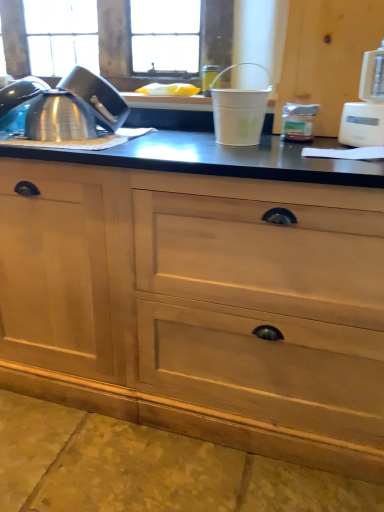
You are a GUI agent. You are given a task and a screenshot of the screen. Output one action in this format:
    pyautogui.click(x=<x>, y=<y>)
    Task: Click on the wooden cabinet at right, the 2th cabinetry in the left-to-right sequence
    The height and width of the screenshot is (512, 384).
    Given the screenshot: What is the action you would take?
    327,56

What do you see at coordinates (64, 106) in the screenshot? I see `satin metallic teapot at left` at bounding box center [64, 106].

Find the location of a particular element. satin metallic teapot at left is located at coordinates (64, 106).

In order to face white plastic blender at right, placed as the 2th appliance when sorted from left to right, should I rotate leftwards or rightwards?

You should rotate right by 25.164 degrees.

Identify the location of white plastic blender at right, placed as the 2th appliance when sorted from left to right. (366, 106).

Where is `wooden cabinet at right, positioned as the first cabinetry in right-to-left order`? This screenshot has height=512, width=384. wooden cabinet at right, positioned as the first cabinetry in right-to-left order is located at coordinates (327, 56).

How many degrees apart are the facing directions of wooden cabinet at right, the 2th cabinetry in the left-to-right sequence, and natural wood cabinet at center, placed as the first cabinetry when sorted from left to right?

The angular difference between wooden cabinet at right, the 2th cabinetry in the left-to-right sequence, and natural wood cabinet at center, placed as the first cabinetry when sorted from left to right, is 0.434 degrees.

Is wooden cabinet at right, positioned as the first cabinetry in right-to-left order, thinner than natural wood cabinet at center, the second cabinetry positioned from the right?

Yes, wooden cabinet at right, positioned as the first cabinetry in right-to-left order, is thinner than natural wood cabinet at center, the second cabinetry positioned from the right.

Between wooden cabinet at right, the 2th cabinetry in the left-to-right sequence, and natural wood cabinet at center, placed as the first cabinetry when sorted from left to right, which one has less height?

wooden cabinet at right, the 2th cabinetry in the left-to-right sequence, is shorter.

Which is further, (288, 92) or (231, 401)?

Positioned behind is point (288, 92).

Which object is more forward, white plastic blender at right, the 1th appliance from the right, or natural wood cabinet at center, placed as the first cabinetry when sorted from left to right?

natural wood cabinet at center, placed as the first cabinetry when sorted from left to right.

Which of these two, white plastic blender at right, the 1th appliance from the right, or natural wood cabinet at center, placed as the first cabinetry when sorted from left to right, is bigger?

Bigger between the two is natural wood cabinet at center, placed as the first cabinetry when sorted from left to right.

Does point (364, 57) come in front of point (335, 439)?

No.

Does natural wood cabinet at center, the second cabinetry positioned from the right, have a smaller size compared to satin metallic teapot at left?

No.

Looking at this image, are natural wood cabinet at center, the second cabinetry positioned from the right, and satin metallic teapot at left far apart?

No, there isn't a large distance between natural wood cabinet at center, the second cabinetry positioned from the right, and satin metallic teapot at left.

Consider the image. Relative to satin metallic teapot at left, is natural wood cabinet at center, placed as the first cabinetry when sorted from left to right, in front or behind?

In the image, natural wood cabinet at center, placed as the first cabinetry when sorted from left to right, appears in front of satin metallic teapot at left.

Is point (357, 352) positioned in front of point (96, 122)?

Yes, it is in front of point (96, 122).

Between white plastic bucket at center, the 1th appliance when ordered from left to right, and white plastic blender at right, the 1th appliance from the right, which one has larger size?

Bigger between the two is white plastic blender at right, the 1th appliance from the right.

From the picture: Considering the sizes of white plastic bucket at center, which is the 2th appliance from right to left, and white plastic blender at right, the 1th appliance from the right, in the image, is white plastic bucket at center, which is the 2th appliance from right to left, taller or shorter than white plastic blender at right, the 1th appliance from the right,?

In the image, white plastic bucket at center, which is the 2th appliance from right to left, appears to be shorter than white plastic blender at right, the 1th appliance from the right.

Is white plastic bucket at center, the 1th appliance when ordered from left to right, positioned beyond the bounds of white plastic blender at right, placed as the 2th appliance when sorted from left to right?

white plastic bucket at center, the 1th appliance when ordered from left to right, is positioned outside white plastic blender at right, placed as the 2th appliance when sorted from left to right.

Which of these two, natural wood cabinet at center, the second cabinetry positioned from the right, or wooden cabinet at right, the 2th cabinetry in the left-to-right sequence, stands shorter?

wooden cabinet at right, the 2th cabinetry in the left-to-right sequence, is shorter.

Is natural wood cabinet at center, placed as the first cabinetry when sorted from left to right, touching wooden cabinet at right, the 2th cabinetry in the left-to-right sequence?

No.

Is point (218, 436) closer to camera compared to point (297, 10)?

Yes.

From a real-world perspective, is natural wood cabinet at center, the second cabinetry positioned from the right, on top of wooden cabinet at right, the 2th cabinetry in the left-to-right sequence?

Actually, natural wood cabinet at center, the second cabinetry positioned from the right, is physically below wooden cabinet at right, the 2th cabinetry in the left-to-right sequence, in the real world.

Between satin metallic teapot at left and natural wood cabinet at center, the second cabinetry positioned from the right, which one is positioned behind?

satin metallic teapot at left is behind.

Does point (81, 77) lie behind point (280, 301)?

Yes, point (81, 77) is farther from viewer.

Can you confirm if satin metallic teapot at left is positioned to the right of natural wood cabinet at center, placed as the first cabinetry when sorted from left to right?

No.

From the image's perspective, which object appears higher, natural wood cabinet at center, the second cabinetry positioned from the right, or white plastic bucket at center, the 1th appliance when ordered from left to right?

white plastic bucket at center, the 1th appliance when ordered from left to right.

Is point (281, 435) positioned behind point (238, 104)?

Yes, it is behind point (238, 104).

Does natural wood cabinet at center, the second cabinetry positioned from the right, come behind white plastic bucket at center, which is the 2th appliance from right to left?

No, the depth of natural wood cabinet at center, the second cabinetry positioned from the right, is less than that of white plastic bucket at center, which is the 2th appliance from right to left.

Find the location of `cabinetry below the wooden cabinet at right, the 2th cabinetry in the left-to-right sequence (from a real-world perspective)`. cabinetry below the wooden cabinet at right, the 2th cabinetry in the left-to-right sequence (from a real-world perspective) is located at coordinates click(199, 306).

Find the location of a particular element. appliance that is the 2nd object located above the natural wood cabinet at center, placed as the first cabinetry when sorted from left to right (from the image's perspective) is located at coordinates (366, 106).

Estimate the real-world distances between objects in this image. Which object is closer to satin metallic teapot at left, white plastic bucket at center, the 1th appliance when ordered from left to right, or white plastic blender at right, the 1th appliance from the right?

white plastic bucket at center, the 1th appliance when ordered from left to right, lies closer to satin metallic teapot at left than the other object.

Looking at the image, which one is located closer to wooden cabinet at right, positioned as the first cabinetry in right-to-left order, white plastic bucket at center, which is the 2th appliance from right to left, or natural wood cabinet at center, the second cabinetry positioned from the right?

Among the two, white plastic bucket at center, which is the 2th appliance from right to left, is located nearer to wooden cabinet at right, positioned as the first cabinetry in right-to-left order.

When comparing their distances from white plastic blender at right, placed as the 2th appliance when sorted from left to right, does satin metallic teapot at left or wooden cabinet at right, the 2th cabinetry in the left-to-right sequence, seem further?

satin metallic teapot at left is further to white plastic blender at right, placed as the 2th appliance when sorted from left to right.

Estimate the real-world distances between objects in this image. Which object is further from white plastic blender at right, the 1th appliance from the right, wooden cabinet at right, positioned as the first cabinetry in right-to-left order, or white plastic bucket at center, which is the 2th appliance from right to left?

Among the two, white plastic bucket at center, which is the 2th appliance from right to left, is located further to white plastic blender at right, the 1th appliance from the right.

Looking at the image, which one is located closer to natural wood cabinet at center, the second cabinetry positioned from the right, white plastic bucket at center, the 1th appliance when ordered from left to right, or satin metallic teapot at left?

The object closer to natural wood cabinet at center, the second cabinetry positioned from the right, is satin metallic teapot at left.

From the image, which object appears to be farther from wooden cabinet at right, positioned as the first cabinetry in right-to-left order, white plastic blender at right, placed as the 2th appliance when sorted from left to right, or satin metallic teapot at left?

Among the two, satin metallic teapot at left is located further to wooden cabinet at right, positioned as the first cabinetry in right-to-left order.

Which object lies further to the anchor point natural wood cabinet at center, the second cabinetry positioned from the right, white plastic blender at right, placed as the 2th appliance when sorted from left to right, or satin metallic teapot at left?

white plastic blender at right, placed as the 2th appliance when sorted from left to right.

Which object lies nearer to the anchor point white plastic bucket at center, which is the 2th appliance from right to left, white plastic blender at right, placed as the 2th appliance when sorted from left to right, or natural wood cabinet at center, the second cabinetry positioned from the right?

Based on the image, white plastic blender at right, placed as the 2th appliance when sorted from left to right, appears to be nearer to white plastic bucket at center, which is the 2th appliance from right to left.

Find the location of a particular element. cabinetry located between satin metallic teapot at left and white plastic bucket at center, the 1th appliance when ordered from left to right, in the left-right direction is located at coordinates (199, 306).

Identify the location of appliance between natural wood cabinet at center, placed as the first cabinetry when sorted from left to right, and wooden cabinet at right, the 2th cabinetry in the left-to-right sequence, from left to right. The width and height of the screenshot is (384, 512). (239, 111).

This screenshot has width=384, height=512. What are the coordinates of `cabinetry between satin metallic teapot at left and wooden cabinet at right, the 2th cabinetry in the left-to-right sequence, from left to right` in the screenshot? It's located at (199, 306).

Locate an element on the screen. The width and height of the screenshot is (384, 512). appliance between satin metallic teapot at left and wooden cabinet at right, positioned as the first cabinetry in right-to-left order is located at coordinates (239, 111).